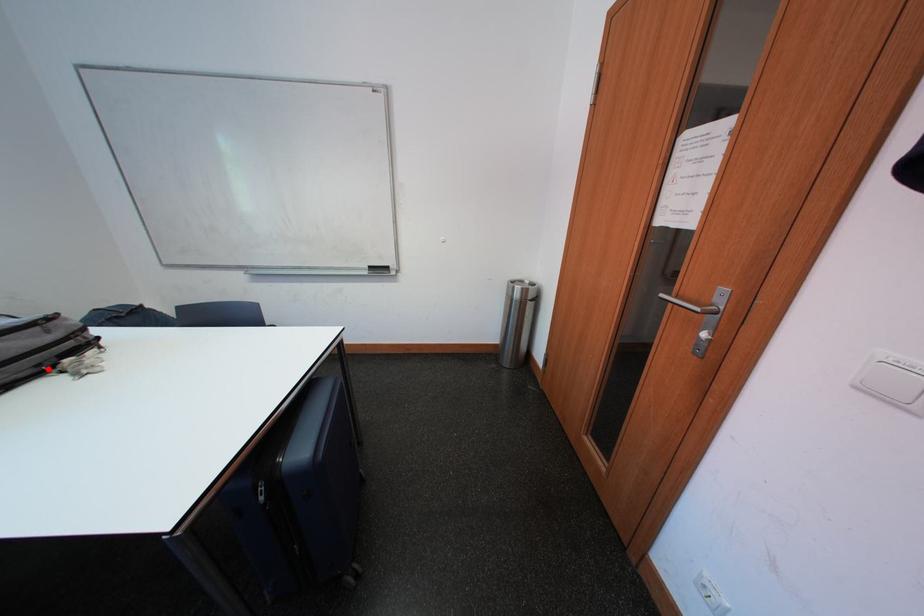
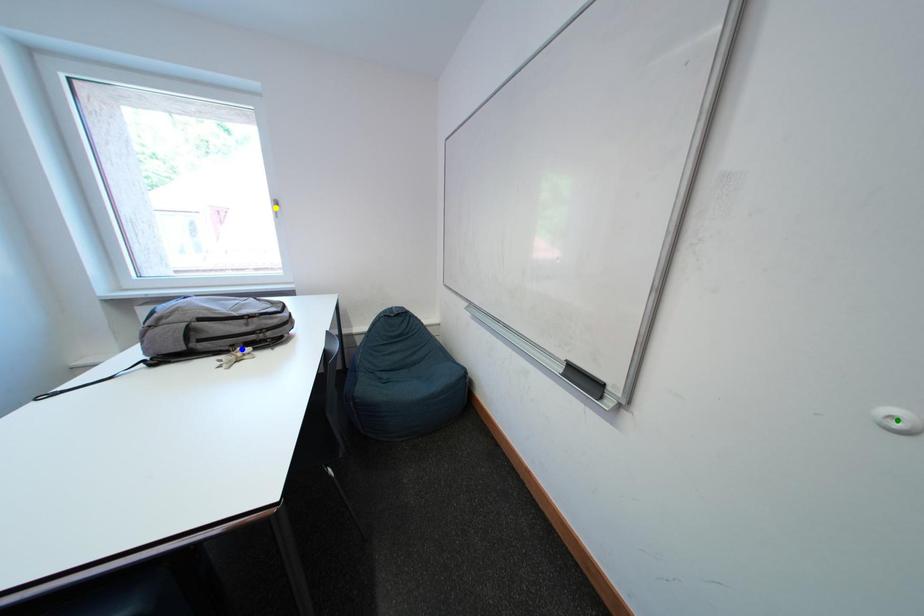
Question: I am providing you with two images of the same scene from different viewpoints. A red point is marked on the first image. You are given multiple points on the second image. In image 2, which mark is for the same physical point as the one in image 1?

Choices:
 (A) green point
 (B) blue point
 (C) yellow point

Answer: (B)